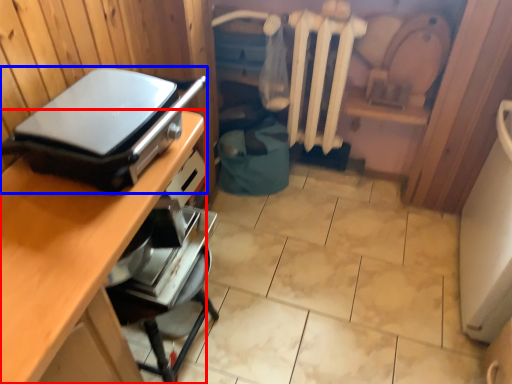
Question: Which point is closer to the camera, desk (highlighted by a red box) or appliance (highlighted by a blue box)?

Choices:
 (A) desk
 (B) appliance

Answer: (A)